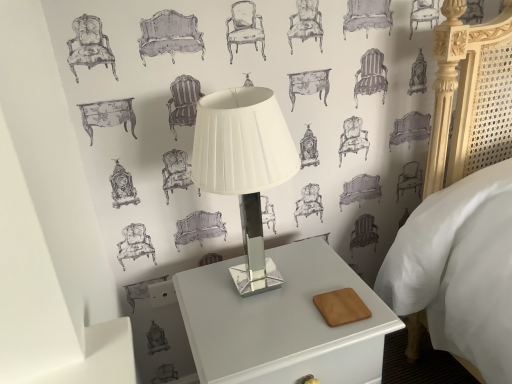
This screenshot has width=512, height=384. I want to click on vacant area on top of white glossy nightstand at center (from a real-world perspective), so click(283, 298).